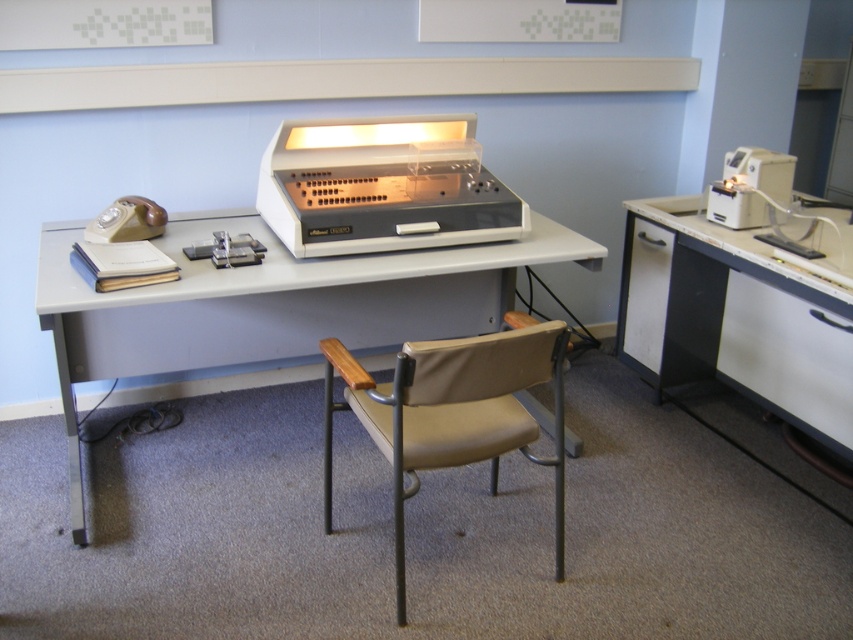
Question: From the image, what is the correct spatial relationship of white glossy computer desk at right in relation to white plastic drawer at right?

Choices:
 (A) above
 (B) below

Answer: (A)

Question: Considering the real-world distances, which object is farthest from the beige plastic telephone at left?

Choices:
 (A) white plastic desk at center
 (B) white plastic drawer at right
 (C) white glossy computer desk at right

Answer: (B)

Question: Can you confirm if white glossy computer desk at right is positioned to the left of white plastic register at center?

Choices:
 (A) no
 (B) yes

Answer: (A)

Question: Based on their relative distances, which object is nearer to the white plastic drawer at right?

Choices:
 (A) beige fabric swivel chair at center
 (B) white plastic desk at center

Answer: (A)

Question: Which point appears farthest from the camera in this image?

Choices:
 (A) (677, 342)
 (B) (509, 371)
 (C) (318, 300)

Answer: (A)

Question: Is beige fabric swivel chair at center positioned before white plastic drawer at right?

Choices:
 (A) no
 (B) yes

Answer: (B)